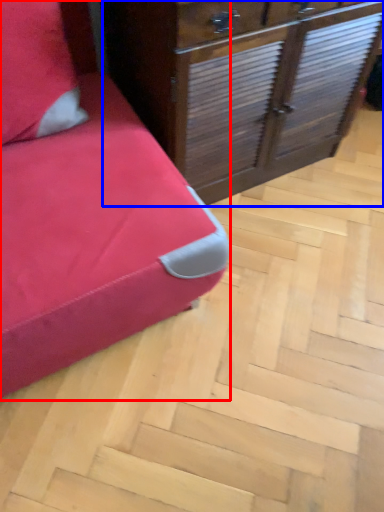
Question: Which object appears farthest to the camera in this image, furniture (highlighted by a red box) or chest of drawers (highlighted by a blue box)?

Choices:
 (A) furniture
 (B) chest of drawers

Answer: (B)